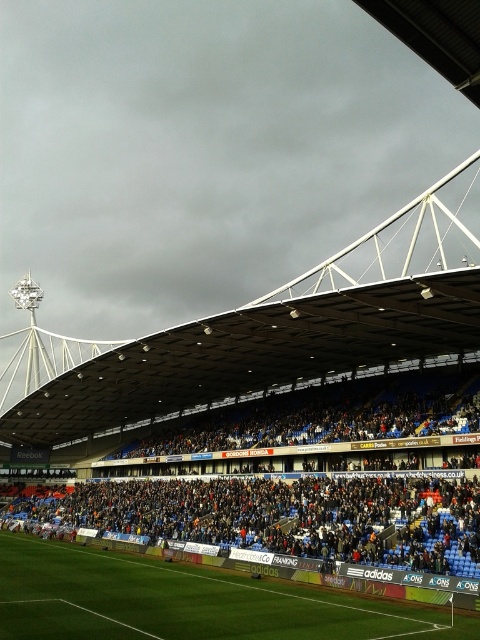
Between dark blue seats at lower center and green grass football field at lower left, which one is positioned lower?

green grass football field at lower left is below.

Looking at this image, does dark blue seats at lower center come in front of green grass football field at lower left?

No.

Is point (140, 516) farther from viewer compared to point (46, 624)?

Yes, it is behind point (46, 624).

This screenshot has width=480, height=640. I want to click on dark blue seats at lower center, so click(x=299, y=504).